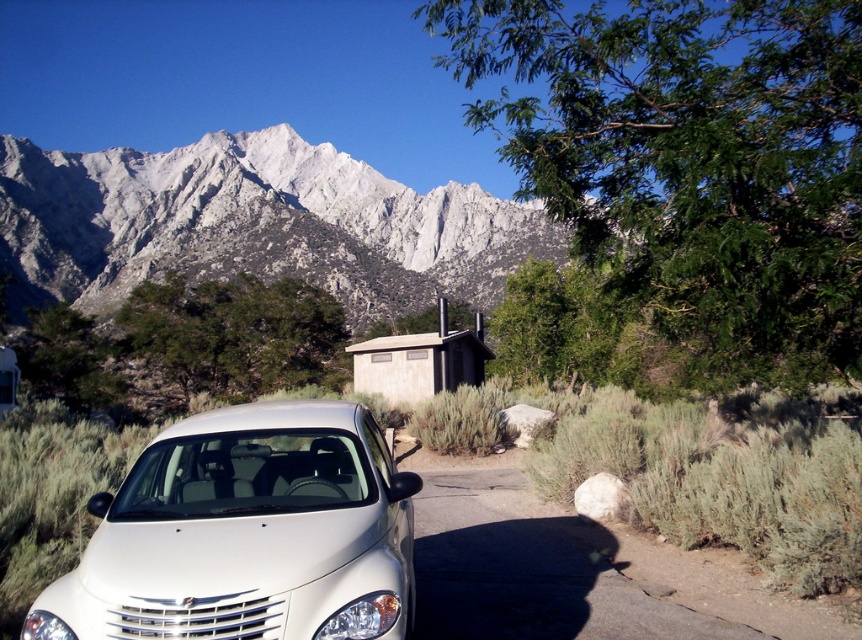
Question: Which of the following is the farthest from the observer?

Choices:
 (A) (376, 339)
 (B) (195, 216)
 (C) (267, 589)

Answer: (B)

Question: Among these points, which one is nearest to the camera?

Choices:
 (A) (383, 465)
 (B) (405, 365)
 (C) (13, 244)

Answer: (A)

Question: Does snowy granite mountain range at upper left appear under beige wood cabin at center?

Choices:
 (A) yes
 (B) no

Answer: (B)

Question: Considering the relative positions of snowy granite mountain range at upper left and white glossy car at lower left in the image provided, where is snowy granite mountain range at upper left located with respect to white glossy car at lower left?

Choices:
 (A) above
 (B) below

Answer: (A)

Question: Can you confirm if snowy granite mountain range at upper left is positioned to the left of white glossy car at lower left?

Choices:
 (A) yes
 (B) no

Answer: (A)

Question: Which of these objects is positioned closest to the beige wood cabin at center?

Choices:
 (A) white glossy car at lower left
 (B) snowy granite mountain range at upper left

Answer: (A)